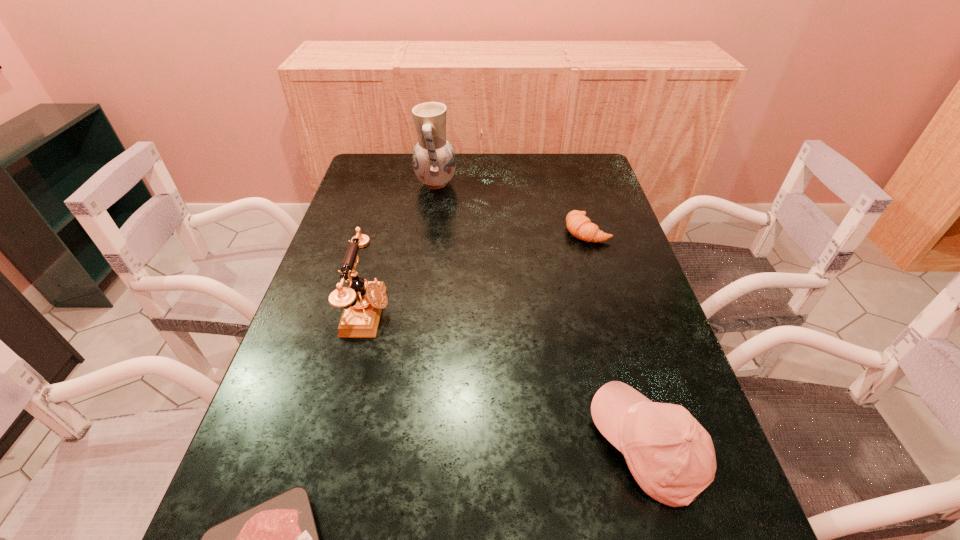
At what (x,y) coordinates should I click in order to perform the action: click on blank space located 0.280m on the front-facing side of the baseball cap. Please return your answer as a coordinate pair (x, y). The image size is (960, 540). Looking at the image, I should click on [x=442, y=447].

This screenshot has height=540, width=960. In order to click on vacant area situated 0.340m on the front-facing side of the baseball cap in this screenshot , I will do `click(410, 447)`.

Locate an element on the screen. This screenshot has width=960, height=540. vacant space located on the front of the fourth tallest object is located at coordinates (599, 272).

The width and height of the screenshot is (960, 540). In order to click on object located in the far edge section of the desktop in this screenshot , I will do `click(434, 161)`.

This screenshot has width=960, height=540. In order to click on object that is at the left edge in this screenshot , I will do `click(363, 301)`.

This screenshot has height=540, width=960. I want to click on baseball cap that is at the right edge, so click(x=671, y=456).

Find the location of `crescent roll at the right edge`. crescent roll at the right edge is located at coordinates (580, 226).

Find the location of a particular element. free point at the far edge is located at coordinates (524, 156).

This screenshot has width=960, height=540. I want to click on free space at the left edge of the desktop, so click(378, 257).

You are a GUI agent. You are given a task and a screenshot of the screen. Output one action in this format:
    pyautogui.click(x=<x>, y=<y>)
    Task: Click on the free region at the right edge of the desktop
    This screenshot has height=540, width=960.
    Given the screenshot: What is the action you would take?
    pyautogui.click(x=599, y=206)